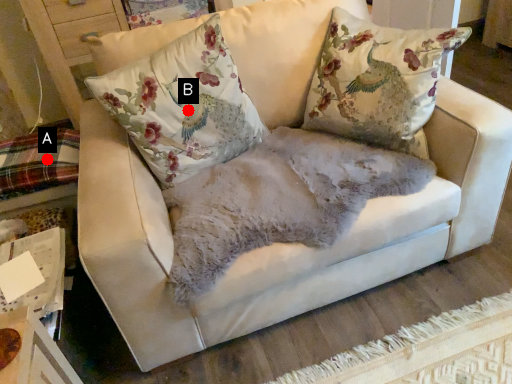
Question: Two points are circled on the image, labeled by A and B beside each circle. Which of the following is the farthest from the observer?

Choices:
 (A) A is further
 (B) B is further

Answer: (A)